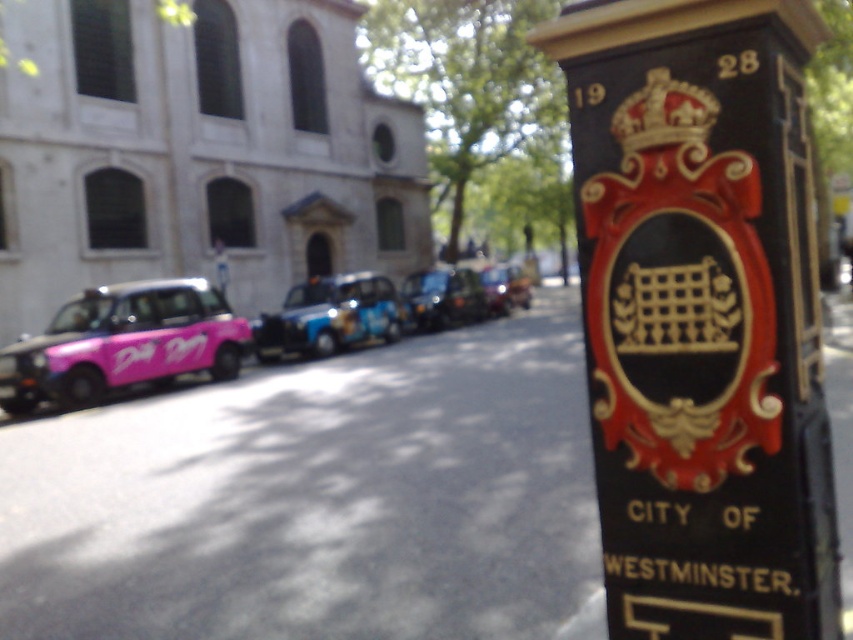
Between point (323, 276) and point (425, 300), which one is positioned in front?

Point (425, 300)

Between point (314, 308) and point (480, 292), which one is positioned behind?

Point (480, 292)

You are a GUI agent. You are given a task and a screenshot of the screen. Output one action in this format:
    pyautogui.click(x=<x>, y=<y>)
    Task: Click on the blue metallic taxi at center
    The height and width of the screenshot is (640, 853).
    Given the screenshot: What is the action you would take?
    pyautogui.click(x=329, y=316)

Is pink matte taxi at left wider than blue metallic taxi at center?

Correct, the width of pink matte taxi at left exceeds that of blue metallic taxi at center.

Which is more to the right, pink matte taxi at left or blue metallic taxi at center?

blue metallic taxi at center is more to the right.

The height and width of the screenshot is (640, 853). What do you see at coordinates (123, 342) in the screenshot?
I see `pink matte taxi at left` at bounding box center [123, 342].

Where is `pink matte taxi at left`? pink matte taxi at left is located at coordinates (123, 342).

Who is more distant from viewer, [228,356] or [434,288]?

The point [434,288] is more distant.

Which is more to the left, pink matte taxi at left or metallic blue taxi at center?

Positioned to the left is pink matte taxi at left.

Is point (228, 336) farther from viewer compared to point (436, 300)?

No, it is in front of (436, 300).

At what (x,y) coordinates should I click in order to perform the action: click on pink matte taxi at left. Please return your answer as a coordinate pair (x, y). This screenshot has height=640, width=853. Looking at the image, I should click on (123, 342).